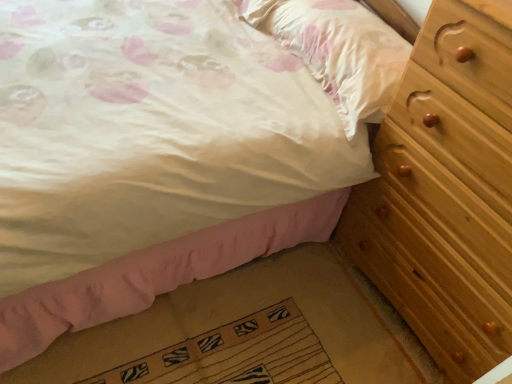
Question: Is textured beige mat at lower center taller or shorter than wooden bed frame at lower right?

Choices:
 (A) tall
 (B) short

Answer: (B)

Question: From a real-world perspective, is textured beige mat at lower center positioned above or below wooden bed frame at lower right?

Choices:
 (A) below
 (B) above

Answer: (B)

Question: Estimate the real-world distances between objects in this image. Which object is farther from the matte white pillow at upper right?

Choices:
 (A) light brown wooden chest of drawers at right
 (B) textured beige mat at lower center
 (C) wooden bed frame at lower right

Answer: (B)

Question: Estimate the real-world distances between objects in this image. Which object is farther from the light brown wooden chest of drawers at right?

Choices:
 (A) textured beige mat at lower center
 (B) wooden bed frame at lower right
 (C) matte white pillow at upper right

Answer: (A)